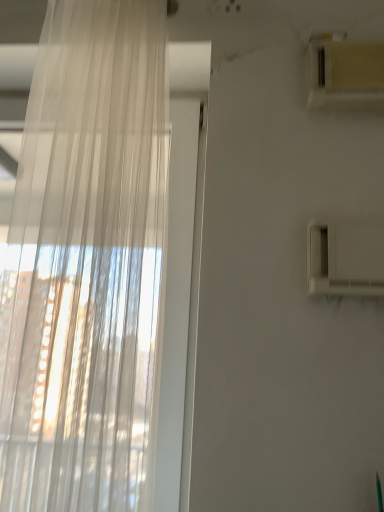
Measure the distance between translucent fabric curtain at left and camera.

25.37 inches.

In order to click on translucent fabric curtain at left in this screenshot , I will do point(86,264).

What do you see at coordinates (86, 264) in the screenshot? I see `translucent fabric curtain at left` at bounding box center [86, 264].

Find the location of a particular element. white plastic air conditioning unit at upper right is located at coordinates (345, 74).

This screenshot has width=384, height=512. Describe the element at coordinates (345, 74) in the screenshot. I see `white plastic air conditioning unit at upper right` at that location.

Measure the distance between white plastic air conditioning unit at upper right and camera.

white plastic air conditioning unit at upper right is 34.17 inches away from camera.

Image resolution: width=384 pixels, height=512 pixels. I want to click on translucent fabric curtain at left, so click(86, 264).

Which object is positioned more to the left, white plastic air conditioning unit at upper right or translucent fabric curtain at left?

translucent fabric curtain at left.

Does white plastic air conditioning unit at upper right lie in front of translucent fabric curtain at left?

No, white plastic air conditioning unit at upper right is further to the viewer.

Considering the positions of point (357, 49) and point (12, 489), is point (357, 49) closer or farther from the camera than point (12, 489)?

Point (357, 49) is positioned farther from the camera compared to point (12, 489).

From the image's perspective, is white plastic air conditioning unit at upper right located beneath translucent fabric curtain at left?

No.

From a real-world perspective, is white plastic air conditioning unit at upper right above or below translucent fabric curtain at left?

Clearly, from a real-world perspective, white plastic air conditioning unit at upper right is above translucent fabric curtain at left.

In terms of width, does white plastic air conditioning unit at upper right look wider or thinner when compared to translucent fabric curtain at left?

white plastic air conditioning unit at upper right is thinner than translucent fabric curtain at left.

Can you confirm if white plastic air conditioning unit at upper right is taller than translucent fabric curtain at left?

In fact, white plastic air conditioning unit at upper right may be shorter than translucent fabric curtain at left.

Is white plastic air conditioning unit at upper right smaller than translucent fabric curtain at left?

Yes, white plastic air conditioning unit at upper right is smaller than translucent fabric curtain at left.

Can we say white plastic air conditioning unit at upper right lies outside translucent fabric curtain at left?

white plastic air conditioning unit at upper right lies outside translucent fabric curtain at left's area.

Is white plastic air conditioning unit at upper right placed right next to translucent fabric curtain at left?

No.

Could you tell me if white plastic air conditioning unit at upper right is facing translucent fabric curtain at left?

No, white plastic air conditioning unit at upper right is not aimed at translucent fabric curtain at left.

Based on the photo, measure the distance from white plastic air conditioning unit at upper right to translucent fabric curtain at left.

A distance of 53.39 centimeters exists between white plastic air conditioning unit at upper right and translucent fabric curtain at left.

The image size is (384, 512). I want to click on curtain below the white plastic air conditioning unit at upper right (from the image's perspective), so click(86, 264).

Considering the relative positions of translucent fabric curtain at left and white plastic air conditioning unit at upper right in the image provided, is translucent fabric curtain at left to the left or to the right of white plastic air conditioning unit at upper right?

Based on their positions, translucent fabric curtain at left is located to the left of white plastic air conditioning unit at upper right.

Is translucent fabric curtain at left positioned in front of white plastic air conditioning unit at upper right?

Yes, translucent fabric curtain at left is closer to the camera.

Is point (139, 473) behind point (348, 99)?

No.

Looking at this image, from the image's perspective, which is above, translucent fabric curtain at left or white plastic air conditioning unit at upper right?

From the image's view, white plastic air conditioning unit at upper right is above.

From a real-world perspective, is translucent fabric curtain at left located higher than white plastic air conditioning unit at upper right?

No, from a real-world perspective, translucent fabric curtain at left is not over white plastic air conditioning unit at upper right

Considering the sizes of objects translucent fabric curtain at left and white plastic air conditioning unit at upper right in the image provided, who is wider, translucent fabric curtain at left or white plastic air conditioning unit at upper right?

Wider between the two is translucent fabric curtain at left.

Who is taller, translucent fabric curtain at left or white plastic air conditioning unit at upper right?

translucent fabric curtain at left.

Can you confirm if translucent fabric curtain at left is smaller than white plastic air conditioning unit at upper right?

Incorrect, translucent fabric curtain at left is not smaller in size than white plastic air conditioning unit at upper right.

Does translucent fabric curtain at left contain white plastic air conditioning unit at upper right?

No.

Is there a large distance between translucent fabric curtain at left and white plastic air conditioning unit at upper right?

translucent fabric curtain at left is actually quite close to white plastic air conditioning unit at upper right.

Is translucent fabric curtain at left oriented towards white plastic air conditioning unit at upper right?

No, translucent fabric curtain at left is not oriented towards white plastic air conditioning unit at upper right.

What's the angular difference between translucent fabric curtain at left and white plastic air conditioning unit at upper right's facing directions?

translucent fabric curtain at left and white plastic air conditioning unit at upper right are facing 0.318 degrees away from each other.

How much distance is there between translucent fabric curtain at left and white plastic air conditioning unit at upper right?

21.02 inches.

You are a GUI agent. You are given a task and a screenshot of the screen. Output one action in this format:
    pyautogui.click(x=<x>, y=<y>)
    Task: Click on the air conditioning that is above the translucent fabric curtain at left (from the image's perspective)
    
    Given the screenshot: What is the action you would take?
    pyautogui.click(x=345, y=74)

The height and width of the screenshot is (512, 384). What are the coordinates of `air conditioning behind the translucent fabric curtain at left` in the screenshot? It's located at (345, 74).

Find the location of a particular element. The width and height of the screenshot is (384, 512). air conditioning on the right of translucent fabric curtain at left is located at coordinates (345, 74).